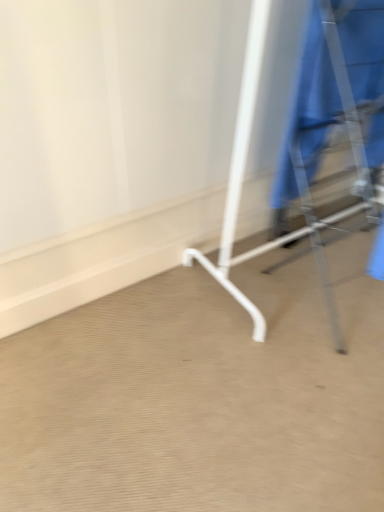
Question: Is metallic silver coat rack at right in front of or behind blue fabric robe at right in the image?

Choices:
 (A) behind
 (B) front

Answer: (B)

Question: Is metallic silver coat rack at right wider or thinner than blue fabric robe at right?

Choices:
 (A) thin
 (B) wide

Answer: (B)

Question: Considering the positions of point (321, 268) and point (365, 157), is point (321, 268) closer or farther from the camera than point (365, 157)?

Choices:
 (A) farther
 (B) closer

Answer: (A)

Question: Looking at the image, does blue fabric robe at right seem bigger or smaller compared to metallic silver coat rack at right?

Choices:
 (A) big
 (B) small

Answer: (B)

Question: From the image's perspective, is blue fabric robe at right above or below metallic silver coat rack at right?

Choices:
 (A) below
 (B) above

Answer: (B)

Question: Is blue fabric robe at right to the left or to the right of metallic silver coat rack at right in the image?

Choices:
 (A) left
 (B) right

Answer: (A)

Question: Is point (332, 2) closer or farther from the camera than point (253, 29)?

Choices:
 (A) farther
 (B) closer

Answer: (B)